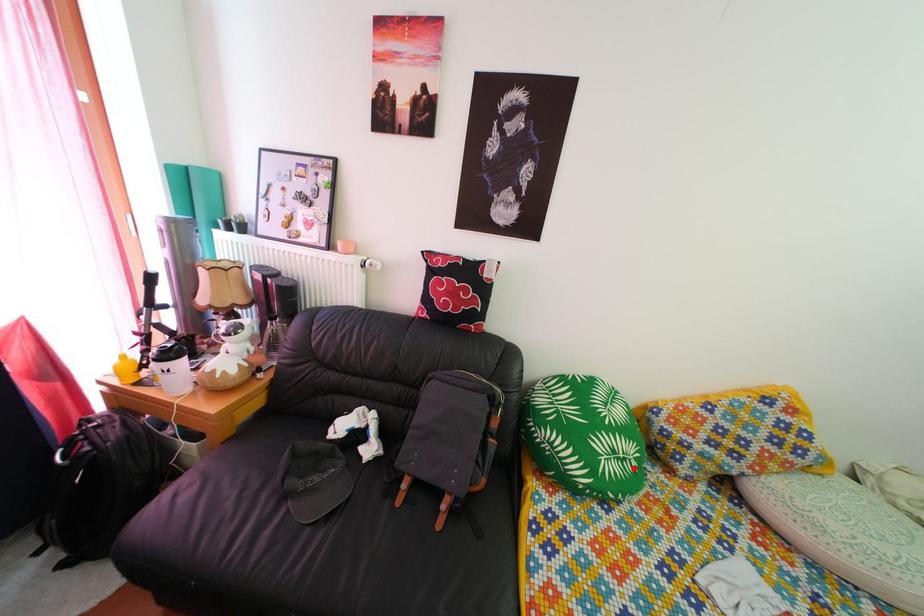
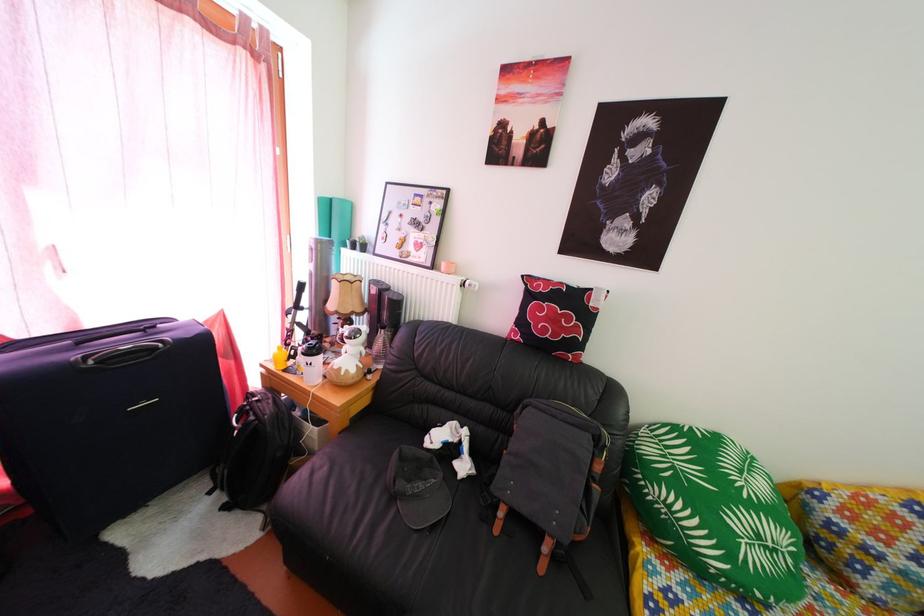
Question: I am providing you with two images of the same scene from different viewpoints. Image1 has a red point marked. In image2, the corresponding 3D location appears at what relative position? Reply with the corresponding letter.

Choices:
 (A) Closer
 (B) Farther

Answer: (A)